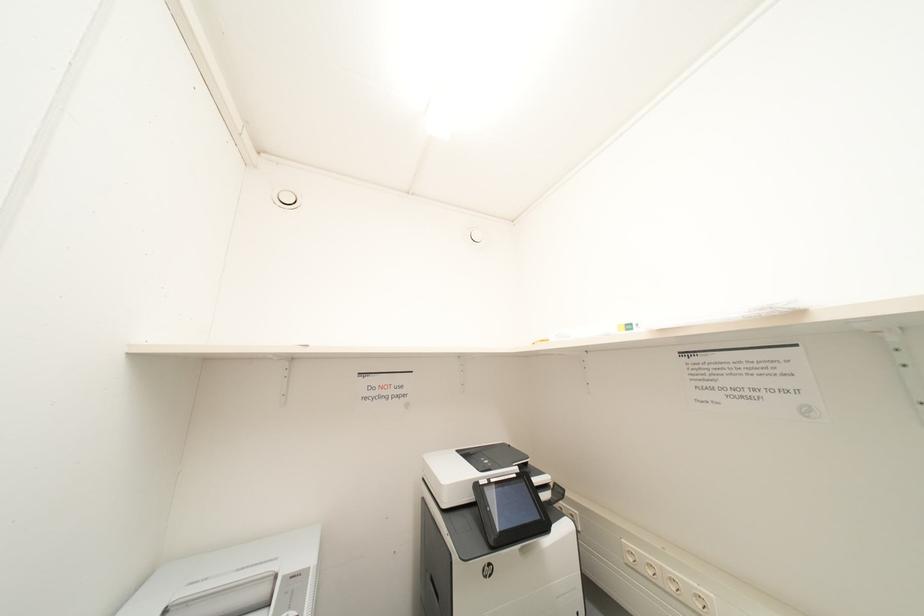
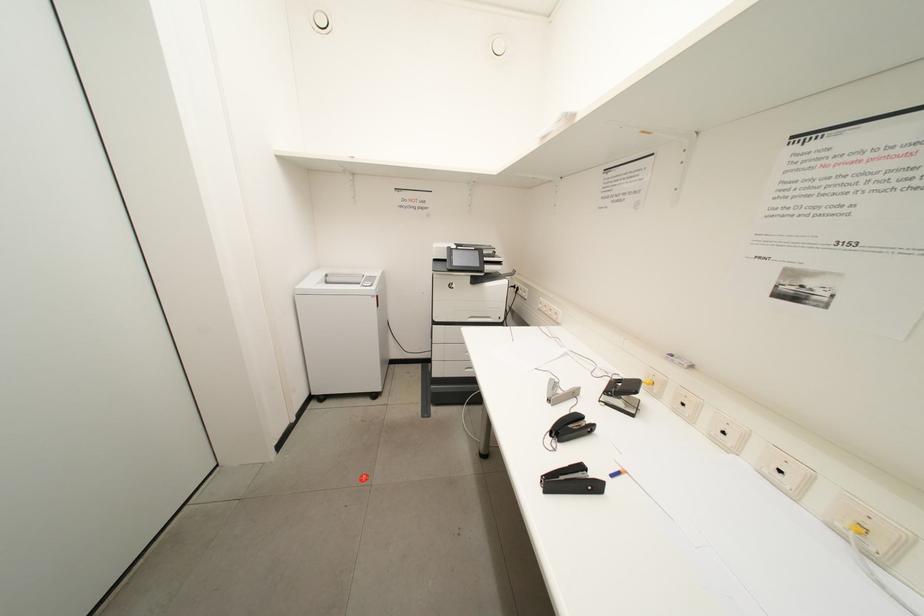
The images are taken continuously from a first-person perspective. In which direction is your viewpoint rotating?

The camera's rotation is toward left-down.